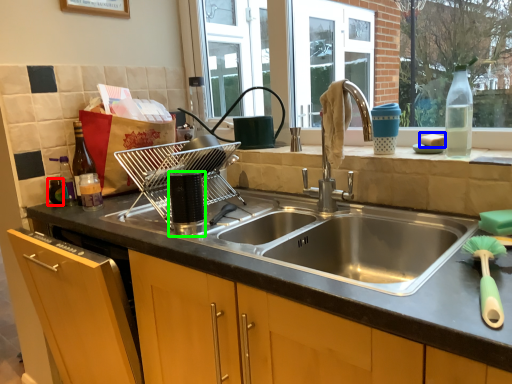
Question: Considering the real-world distances, which object is farthest from bottle (highlighted by a red box)? food (highlighted by a blue box) or appliance (highlighted by a green box)?

Choices:
 (A) food
 (B) appliance

Answer: (A)